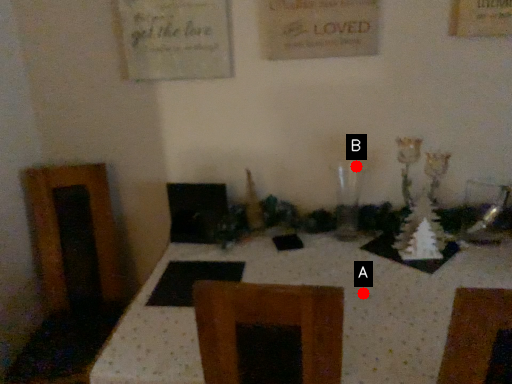
Question: Two points are circled on the image, labeled by A and B beside each circle. Which point appears farthest from the camera in this image?

Choices:
 (A) A is further
 (B) B is further

Answer: (B)